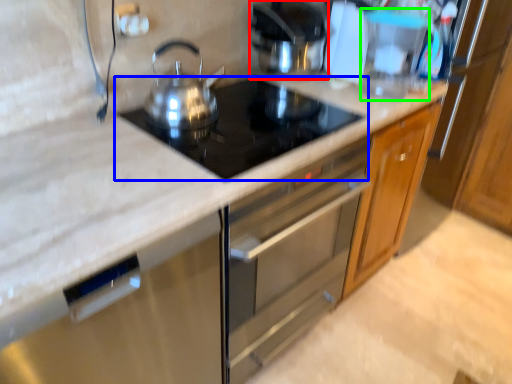
Question: Based on their relative distances, which object is nearer to kitchen appliance (highlighted by a red box)? Choose from gas stove (highlighted by a blue box) and appliance (highlighted by a green box).

Choices:
 (A) gas stove
 (B) appliance

Answer: (B)